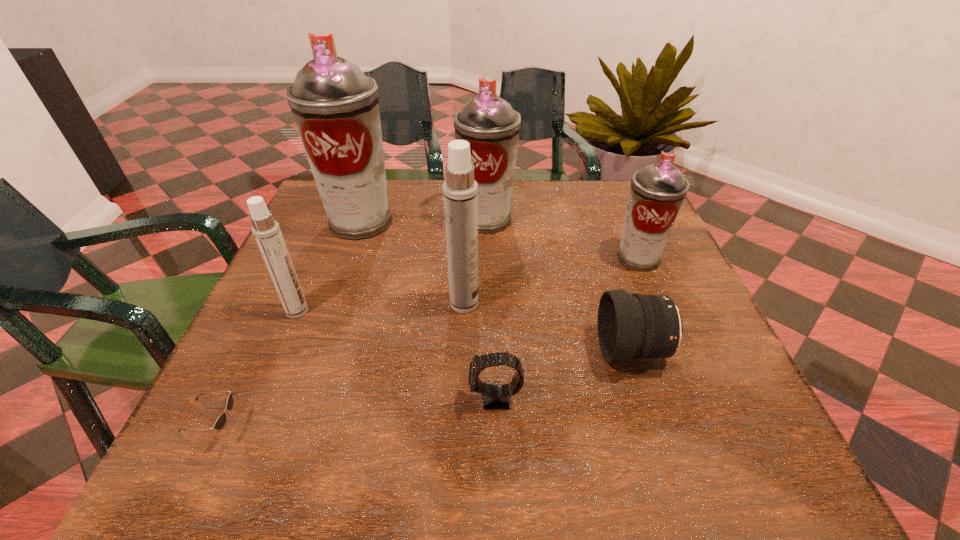
Find the location of a particular element. This screenshot has width=960, height=540. vacant region located 0.210m at the front element of the black telephoto lens is located at coordinates (x=491, y=350).

Image resolution: width=960 pixels, height=540 pixels. I want to click on free spot located 0.330m on the face of the watch, so click(278, 399).

You are a GUI agent. You are given a task and a screenshot of the screen. Output one action in this format:
    pyautogui.click(x=<x>, y=<y>)
    Task: Click on the vacant point located on the face of the watch
    
    Given the screenshot: What is the action you would take?
    pyautogui.click(x=330, y=399)

Locate an element on the screen. The height and width of the screenshot is (540, 960). free location located on the face of the watch is located at coordinates (342, 399).

What are the coordinates of `vacant space positioned in front of the lenses of the shortest object` in the screenshot? It's located at (430, 429).

Where is `object located at the near edge`? object located at the near edge is located at coordinates (220, 422).

Locate an element on the screen. This screenshot has height=540, width=960. sunglasses that is at the left edge is located at coordinates (220, 422).

Where is `aerosol can at the right edge`? Image resolution: width=960 pixels, height=540 pixels. aerosol can at the right edge is located at coordinates (657, 191).

The height and width of the screenshot is (540, 960). I want to click on telephoto lens situated at the right edge, so click(630, 326).

This screenshot has height=540, width=960. Find the location of `object present at the far left corner`. object present at the far left corner is located at coordinates (335, 106).